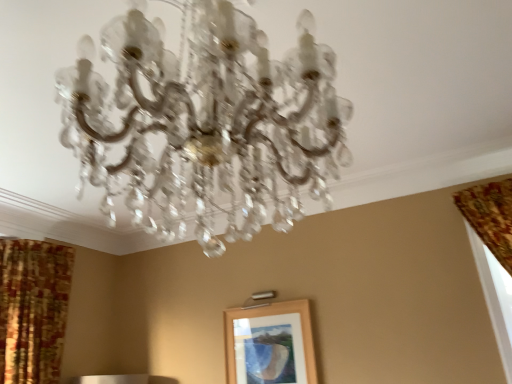
Question: Which is correct: wooden picture frame at center is inside clear crystal chandelier at center, or outside of it?

Choices:
 (A) outside
 (B) inside

Answer: (A)

Question: Considering the relative positions of wooden picture frame at center and clear crystal chandelier at center in the image provided, is wooden picture frame at center to the left or to the right of clear crystal chandelier at center?

Choices:
 (A) right
 (B) left

Answer: (A)

Question: Which object is the closest to the patterned fabric curtain at left?

Choices:
 (A) wooden picture frame at center
 (B) clear crystal chandelier at center

Answer: (A)

Question: Which object is positioned closest to the clear crystal chandelier at center?

Choices:
 (A) wooden picture frame at center
 (B) patterned fabric curtain at left

Answer: (A)